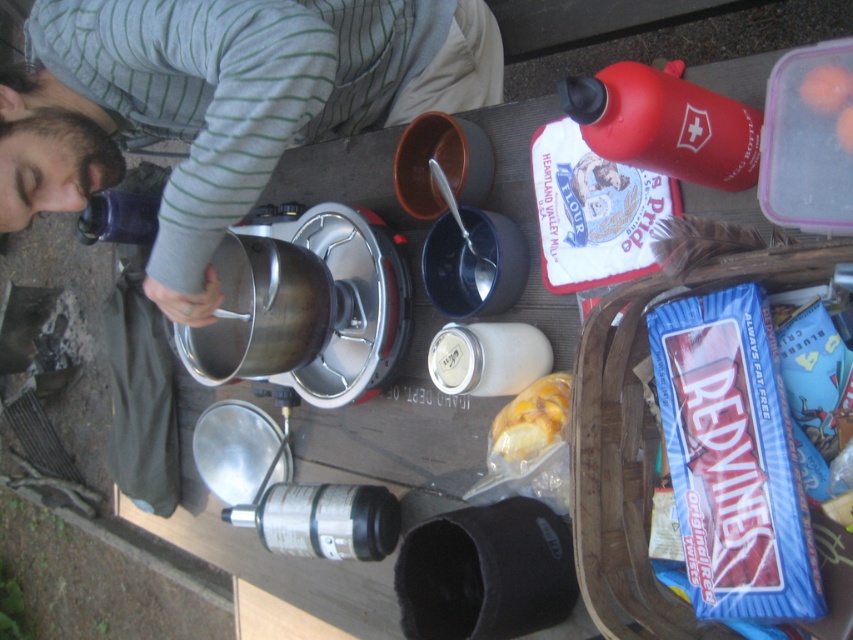
Question: Which object is the closest to the orange translucent container at upper right?

Choices:
 (A) transparent plastic bottle at upper left
 (B) translucent plastic bag at center
 (C) gray striped shirt at upper left
 (D) red matte water bottle at upper right

Answer: (D)

Question: Can you confirm if gray striped shirt at upper left is positioned below red matte water bottle at upper right?

Choices:
 (A) yes
 (B) no

Answer: (B)

Question: Which point is closer to the camera?

Choices:
 (A) (746, 145)
 (B) (491, 426)

Answer: (A)

Question: Among these points, which one is nearest to the camera?

Choices:
 (A) (677, 172)
 (B) (126, 209)
 (C) (312, 72)
 (D) (834, 70)

Answer: (D)

Question: Observing the image, what is the correct spatial positioning of gray striped shirt at upper left in reference to red matte water bottle at upper right?

Choices:
 (A) right
 (B) left

Answer: (B)

Question: Is the position of red matte water bottle at upper right more distant than that of orange translucent container at upper right?

Choices:
 (A) no
 (B) yes

Answer: (B)